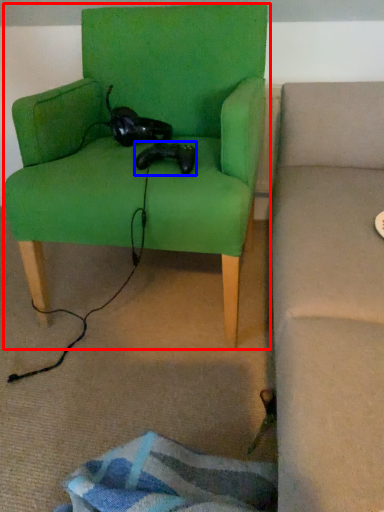
Question: Which point is further to the camera, chair (highlighted by a red box) or animal (highlighted by a blue box)?

Choices:
 (A) chair
 (B) animal

Answer: (B)